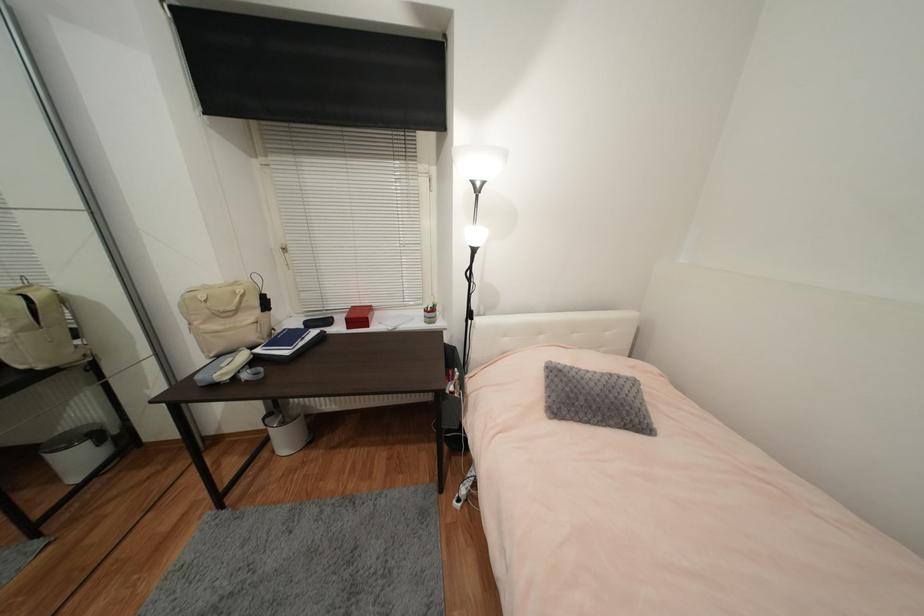
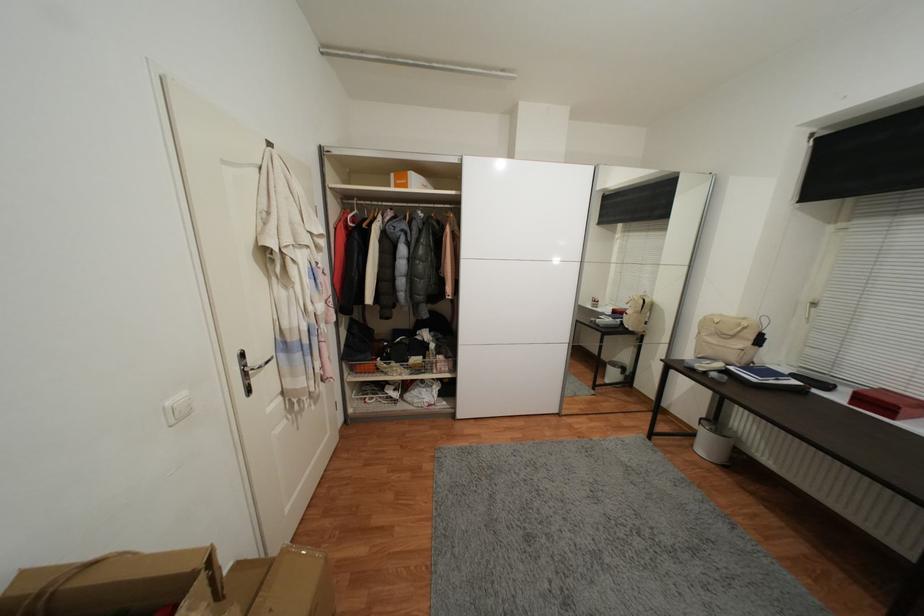
Locate, in the second image, the point that corresponds to the point at 334,323 in the first image.

(831, 387)